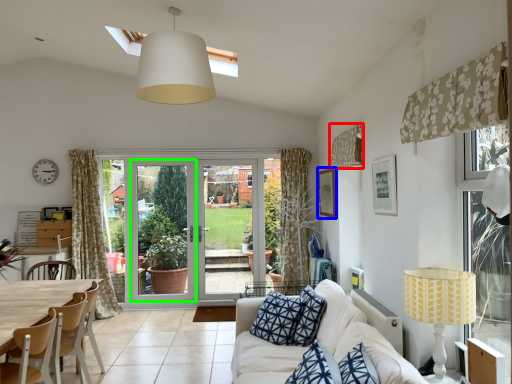
Question: Estimate the real-world distances between objects in this image. Which object is closer to curtain (highlighted by a red box), picture frame (highlighted by a blue box) or screen door (highlighted by a green box)?

Choices:
 (A) picture frame
 (B) screen door

Answer: (A)